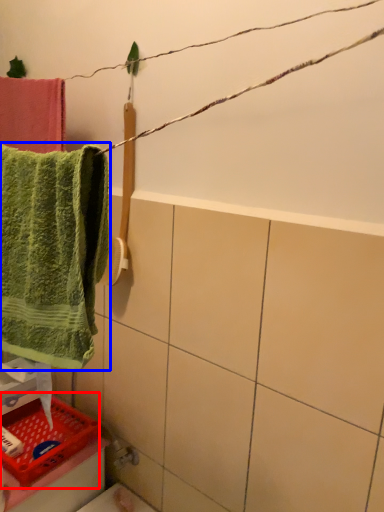
Question: Which point is closer to the camera, basket (highlighted by a red box) or towel (highlighted by a blue box)?

Choices:
 (A) basket
 (B) towel

Answer: (B)